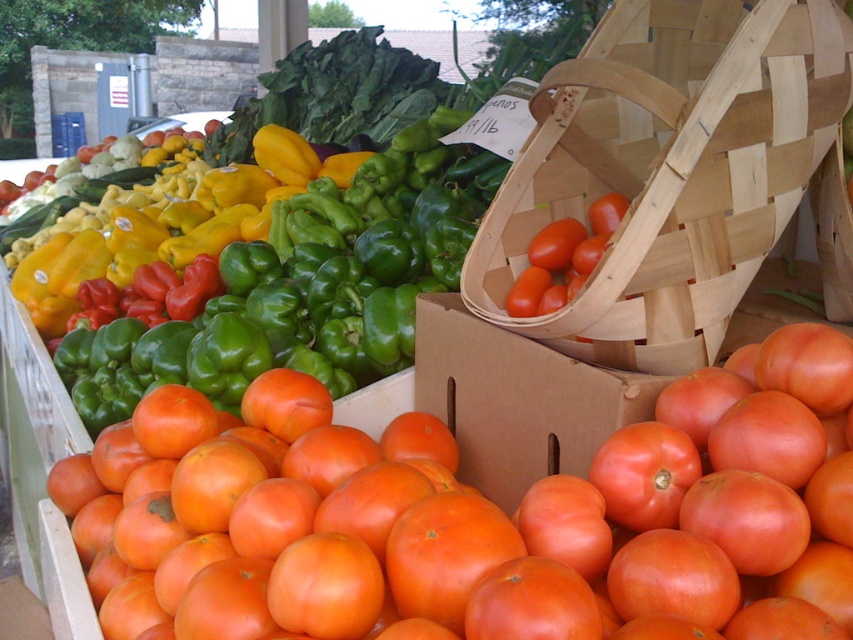
You are a customer at the farmer market and want to place the shiny red tomato at center into the wooden woven basket at upper center. Can you fit the tomato into the basket based on their sizes?

The wooden woven basket at upper center is taller than the shiny red tomato at center, so the tomato should fit inside the basket as long as the opening is wide enough.